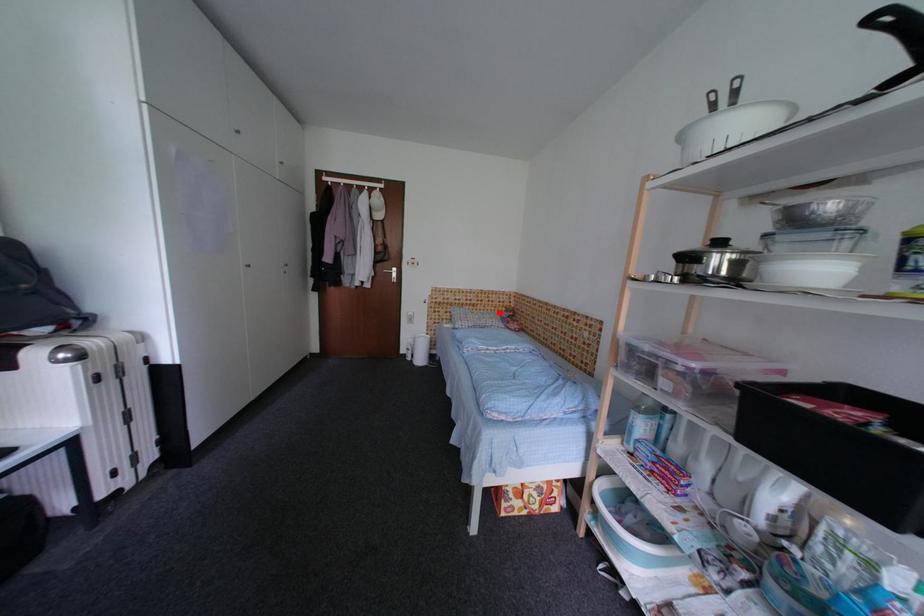
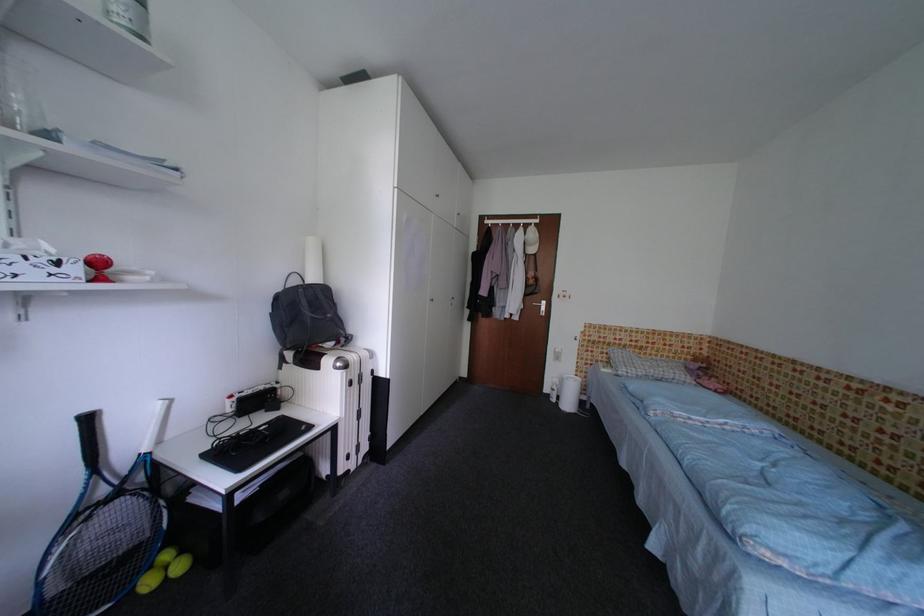
Locate, in the second image, the point that corresponds to the highlighted location in the first image.

(675, 360)